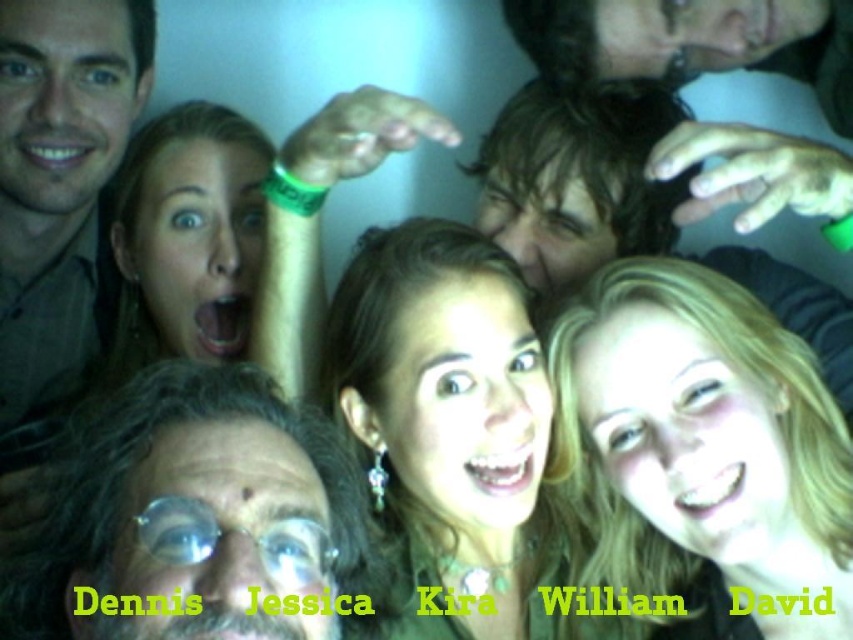
Question: Which of these objects is positioned closest to the curly hair man at center?

Choices:
 (A) shiny gold necklace at center
 (B) matte brown shirt at left
 (C) dark brown hair at upper center

Answer: (A)

Question: Can you confirm if blonde hair at center is thinner than shiny gold necklace at center?

Choices:
 (A) no
 (B) yes

Answer: (B)

Question: Which object is the closest to the dark brown hair at upper center?

Choices:
 (A) blonde hair at center
 (B) curly hair man at center
 (C) matte brown shirt at left
 (D) shiny gold necklace at center

Answer: (A)

Question: Can you confirm if blonde hair at center is positioned to the right of shiny gold necklace at center?

Choices:
 (A) yes
 (B) no

Answer: (A)

Question: Which object is closer to the camera taking this photo?

Choices:
 (A) curly hair man at center
 (B) dark brown hair at upper center

Answer: (A)

Question: Can you confirm if matte brown shirt at left is wider than dark brown hair at upper center?

Choices:
 (A) yes
 (B) no

Answer: (B)